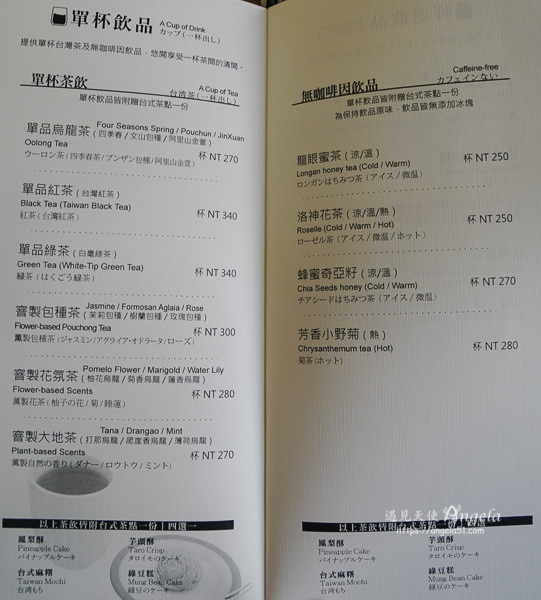
At what (x,y) coordinates should I click in order to perform the action: click on plate. Please return your answer as a coordinate pair (x, y). Image resolution: width=541 pixels, height=600 pixels. Looking at the image, I should click on (217, 589).